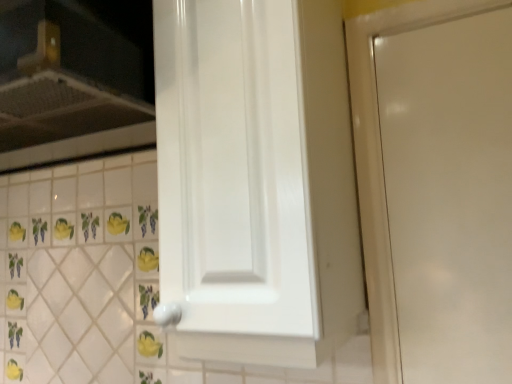
Describe the element at coordinates (256, 179) in the screenshot. I see `white glossy cabinet door at center` at that location.

This screenshot has height=384, width=512. Identify the location of white glossy cabinet door at center. (256, 179).

You are a GUI agent. You are given a task and a screenshot of the screen. Output one action in this format:
    pyautogui.click(x=<x>, y=<y>)
    Task: Click on the white glossy vent at upper left
    
    Given the screenshot: What is the action you would take?
    pyautogui.click(x=74, y=79)

What do you see at coordinates (74, 79) in the screenshot?
I see `white glossy vent at upper left` at bounding box center [74, 79].

Image resolution: width=512 pixels, height=384 pixels. Identify the location of white glossy cabinet door at center. (256, 179).

Which object is positioned more to the left, white glossy vent at upper left or white glossy cabinet door at center?

From the viewer's perspective, white glossy vent at upper left appears more on the left side.

Considering the relative positions of white glossy vent at upper left and white glossy cabinet door at center in the image provided, is white glossy vent at upper left behind white glossy cabinet door at center?

Yes.

Between point (106, 29) and point (319, 69), which one is positioned behind?

The point (106, 29) is behind.

From the image's perspective, relative to white glossy cabinet door at center, is white glossy vent at upper left above or below?

Based on their image positions, white glossy vent at upper left is located above white glossy cabinet door at center.

From a real-world perspective, which object rests below the other?

white glossy cabinet door at center.

Looking at their sizes, would you say white glossy vent at upper left is wider or thinner than white glossy cabinet door at center?

Clearly, white glossy vent at upper left has more width compared to white glossy cabinet door at center.

Who is taller, white glossy vent at upper left or white glossy cabinet door at center?

white glossy cabinet door at center.

Based on their sizes in the image, would you say white glossy vent at upper left is bigger or smaller than white glossy cabinet door at center?

In the image, white glossy vent at upper left appears to be larger than white glossy cabinet door at center.

Is white glossy vent at upper left inside or outside of white glossy cabinet door at center?

white glossy vent at upper left is located beyond the bounds of white glossy cabinet door at center.

Is there a large distance between white glossy vent at upper left and white glossy cabinet door at center?

No, white glossy vent at upper left is not far away from white glossy cabinet door at center.

Could you tell me if white glossy vent at upper left is facing white glossy cabinet door at center?

No, white glossy vent at upper left is not turned towards white glossy cabinet door at center.

Locate an element on the screen. This screenshot has width=512, height=384. door in front of the white glossy vent at upper left is located at coordinates (256, 179).

Considering the relative positions of white glossy cabinet door at center and white glossy vent at upper left in the image provided, is white glossy cabinet door at center to the right of white glossy vent at upper left from the viewer's perspective?

Indeed, white glossy cabinet door at center is positioned on the right side of white glossy vent at upper left.

Who is more distant, white glossy cabinet door at center or white glossy vent at upper left?

white glossy vent at upper left is more distant.

Is point (187, 261) closer or farther from the camera than point (125, 100)?

Point (187, 261) is closer to the camera than point (125, 100).

From the image's perspective, is white glossy cabinet door at center located beneath white glossy vent at upper left?

Correct, white glossy cabinet door at center appears lower than white glossy vent at upper left in the image.

From a real-world perspective, is white glossy cabinet door at center above or below white glossy vent at upper left?

In terms of real-world spatial position, white glossy cabinet door at center is below white glossy vent at upper left.

Does white glossy cabinet door at center have a greater width compared to white glossy vent at upper left?

Incorrect, the width of white glossy cabinet door at center does not surpass that of white glossy vent at upper left.

Who is shorter, white glossy cabinet door at center or white glossy vent at upper left?

white glossy vent at upper left is shorter.

In the scene shown: Does white glossy cabinet door at center have a larger size compared to white glossy vent at upper left?

Incorrect, white glossy cabinet door at center is not larger than white glossy vent at upper left.

Can we say white glossy cabinet door at center lies outside white glossy vent at upper left?

Absolutely, white glossy cabinet door at center is external to white glossy vent at upper left.

Is white glossy cabinet door at center not near white glossy vent at upper left?

white glossy cabinet door at center is near white glossy vent at upper left, not far away.

Could you tell me if white glossy cabinet door at center is facing white glossy vent at upper left?

No, white glossy cabinet door at center does not turn towards white glossy vent at upper left.

Measure the distance between white glossy cabinet door at center and white glossy vent at upper left.

13.36 inches.

Find the location of `door that is below the white glossy vent at upper left (from the image's perspective)`. door that is below the white glossy vent at upper left (from the image's perspective) is located at coordinates (x=256, y=179).

Locate an element on the screen. The height and width of the screenshot is (384, 512). door below the white glossy vent at upper left (from a real-world perspective) is located at coordinates (256, 179).

What are the coordinates of `door that appears in front of the white glossy vent at upper left` in the screenshot? It's located at (256, 179).